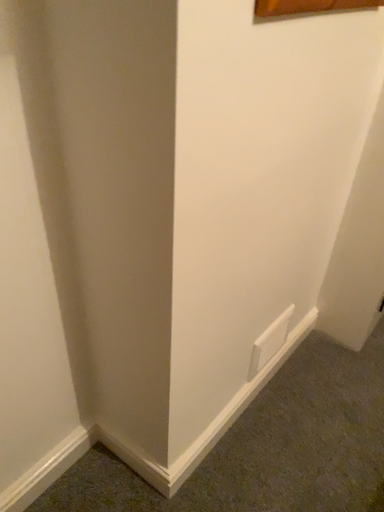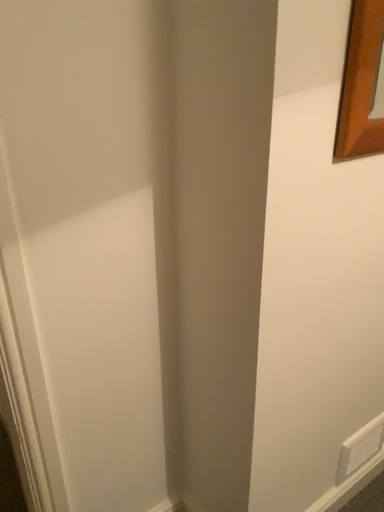
Question: Which way did the camera rotate in the video?

Choices:
 (A) rotated left
 (B) rotated right

Answer: (A)